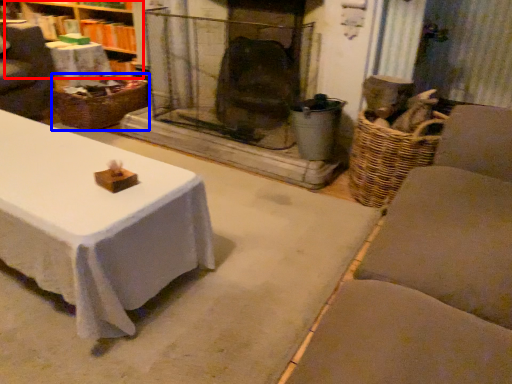
Question: Which object appears farthest to the camera in this image, bookshelf (highlighted by a red box) or basket (highlighted by a blue box)?

Choices:
 (A) bookshelf
 (B) basket

Answer: (A)